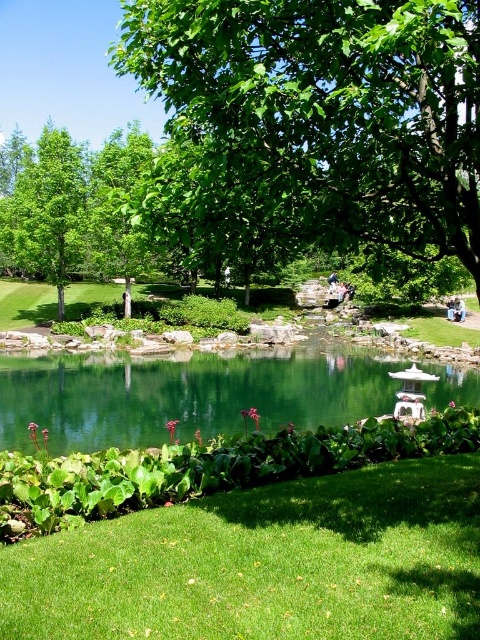
Between green glossy lake at center and green leafy tree at left, which one is positioned lower?

green glossy lake at center is lower down.

Does green glossy lake at center appear on the left side of green leafy tree at left?

No, green glossy lake at center is not to the left of green leafy tree at left.

In the scene shown: Who is more distant from viewer, [4,442] or [28,230]?

Positioned behind is point [28,230].

Locate an element on the screen. green glossy lake at center is located at coordinates (183, 396).

Who is positioned more to the right, green leafy tree at center or green leafy tree at left?

From the viewer's perspective, green leafy tree at center appears more on the right side.

Is green leafy tree at center in front of green leafy tree at left?

Yes.

The width and height of the screenshot is (480, 640). What are the coordinates of `green leafy tree at center` in the screenshot? It's located at click(x=330, y=106).

Can you confirm if green grass at lower center is smaller than green glossy lake at center?

Yes.

Who is taller, green grass at lower center or green glossy lake at center?

green glossy lake at center

Who is more forward, (165, 634) or (121, 426)?

Point (165, 634) is more forward.

The height and width of the screenshot is (640, 480). I want to click on green grass at lower center, so click(x=265, y=563).